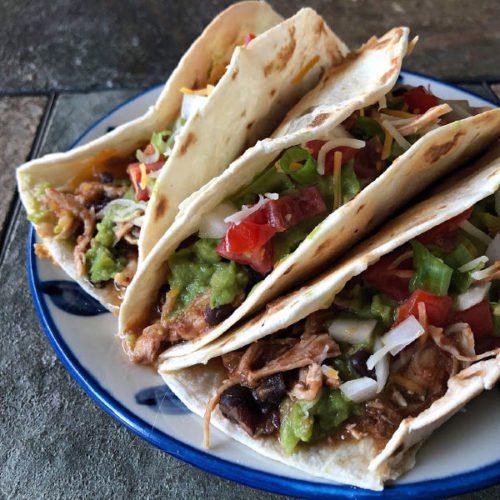
The image size is (500, 500). What are the coordinates of `grey tile lower left corner` in the screenshot? It's located at (132, 474), (69, 441), (22, 367).